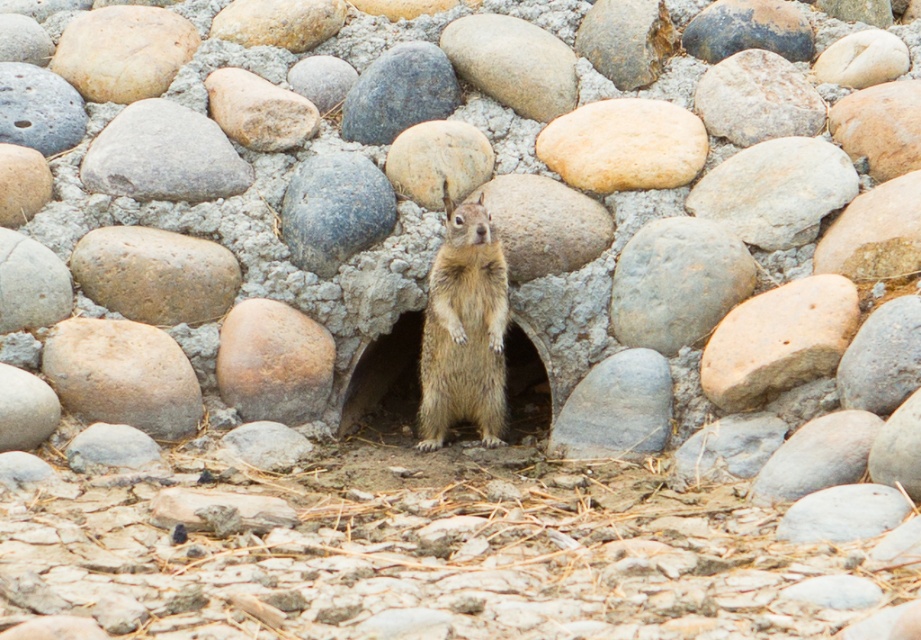
You are a small animal trying to climb onto the smooth beige rock at lower left and the brown rough rock at center. Which rock would be easier to climb based on their surfaces?

The smooth beige rock at lower left has a smoother surface, making it harder to climb compared to the brown rough rock at center, which has a rougher surface providing better grip.

You are standing 5 meters away from the brown rough rock at center. Can you reach it without moving your feet?

The brown rough rock at center is 5.26 meters away from the viewer, so you cannot reach it without moving your feet since it is slightly farther than 5 meters.

You are a geologist examining the rock formation in the image. You notice a point marked at coordinates (624, 145). What type of rock is located at this point?

The point at coordinates (624, 145) indicates a smooth beige rock at center.